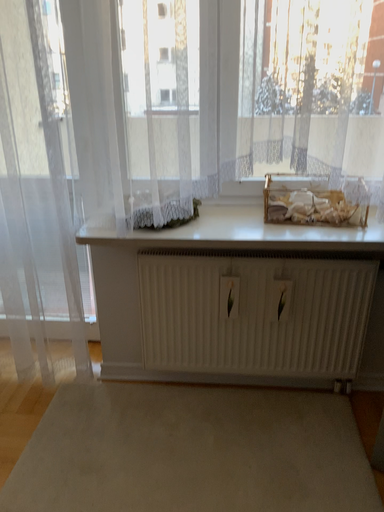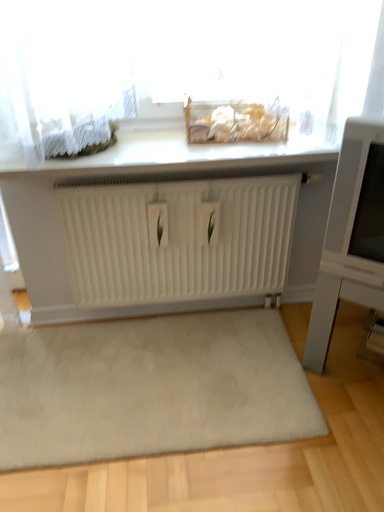
Question: Which way did the camera rotate in the video?

Choices:
 (A) rotated downward
 (B) rotated upward

Answer: (A)